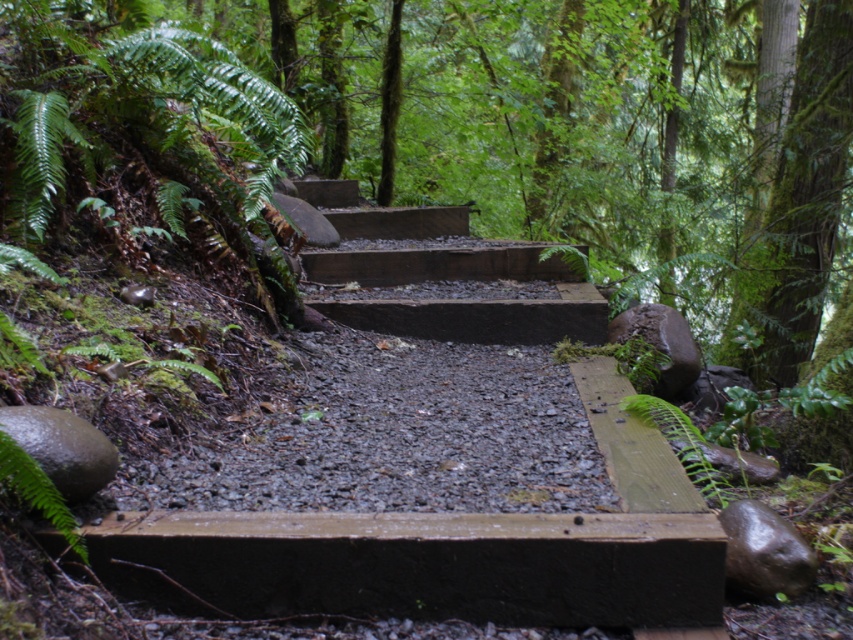
Who is more distant from viewer, (337,248) or (10,468)?

Positioned behind is point (337,248).

Is brown wooden stairs at center bigger than green matte fern at lower left?

Indeed, brown wooden stairs at center has a larger size compared to green matte fern at lower left.

Which is in front, point (561, 268) or point (62, 508)?

Point (62, 508)

The image size is (853, 640). Find the location of `brown wooden stairs at center`. brown wooden stairs at center is located at coordinates (442, 275).